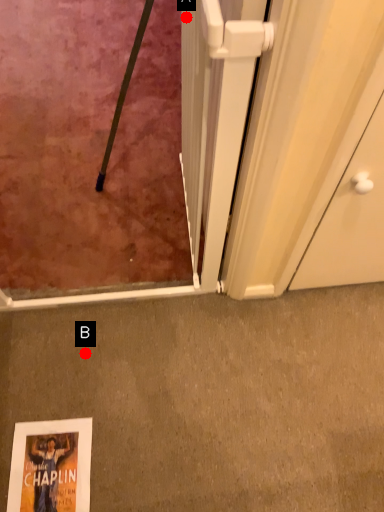
Question: Two points are circled on the image, labeled by A and B beside each circle. Among these points, which one is nearest to the camera?

Choices:
 (A) A is closer
 (B) B is closer

Answer: (A)